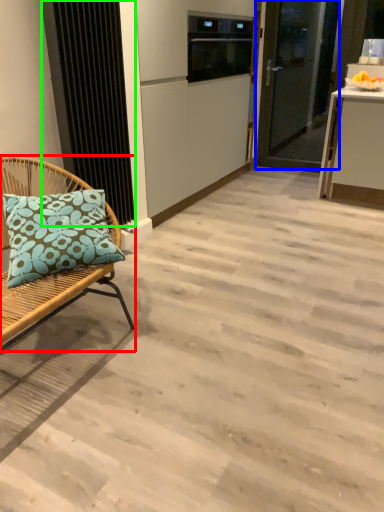
Question: Which object is positioned closest to chair (highlighted by a red box)? Select from door (highlighted by a blue box) and radiator (highlighted by a green box).

Choices:
 (A) door
 (B) radiator

Answer: (B)